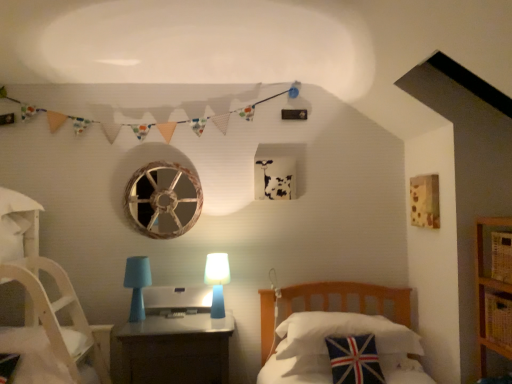
Question: From a real-world perspective, is yellow woven basket at lower right positioned over matte plastic nightstand at center based on gravity?

Choices:
 (A) yes
 (B) no

Answer: (A)

Question: Is yellow woven basket at lower right to the left of matte plastic nightstand at center from the viewer's perspective?

Choices:
 (A) yes
 (B) no

Answer: (B)

Question: Can you confirm if yellow woven basket at lower right is shorter than matte plastic nightstand at center?

Choices:
 (A) yes
 (B) no

Answer: (A)

Question: Can you confirm if yellow woven basket at lower right is thinner than matte plastic nightstand at center?

Choices:
 (A) yes
 (B) no

Answer: (A)

Question: Can you confirm if yellow woven basket at lower right is taller than matte plastic nightstand at center?

Choices:
 (A) yes
 (B) no

Answer: (B)

Question: Is point (212, 281) closer or farther from the camera than point (358, 347)?

Choices:
 (A) closer
 (B) farther

Answer: (B)

Question: Is blue matte table lamp at center, positioned as the 1th table lamp in right-to-left order, inside the boundaries of union jack fabric pillow at lower right, which is the second pillow from back to front, or outside?

Choices:
 (A) outside
 (B) inside

Answer: (A)

Question: Considering the relative positions of blue matte table lamp at center, positioned as the 1th table lamp in right-to-left order, and union jack fabric pillow at lower right, which appears as the first pillow when viewed from the front, in the image provided, is blue matte table lamp at center, positioned as the 1th table lamp in right-to-left order, to the left or to the right of union jack fabric pillow at lower right, which appears as the first pillow when viewed from the front,?

Choices:
 (A) right
 (B) left

Answer: (B)

Question: Is blue matte table lamp at center, positioned as the 1th table lamp in right-to-left order, bigger or smaller than union jack fabric pillow at lower right, which is the second pillow from back to front?

Choices:
 (A) big
 (B) small

Answer: (B)

Question: Considering the relative positions of matte plastic nightstand at center and satin silver desktop at center in the image provided, is matte plastic nightstand at center to the left or to the right of satin silver desktop at center?

Choices:
 (A) right
 (B) left

Answer: (A)

Question: Looking at the image, does matte plastic nightstand at center seem bigger or smaller compared to satin silver desktop at center?

Choices:
 (A) small
 (B) big

Answer: (B)

Question: Considering their positions, is matte plastic nightstand at center located in front of or behind satin silver desktop at center?

Choices:
 (A) front
 (B) behind

Answer: (A)

Question: Considering the positions of matte plastic nightstand at center and satin silver desktop at center in the image, is matte plastic nightstand at center wider or thinner than satin silver desktop at center?

Choices:
 (A) thin
 (B) wide

Answer: (B)

Question: In terms of size, does matte plastic nightstand at center appear bigger or smaller than union jack fabric pillow at center, which is the 2th pillow from front to back?

Choices:
 (A) small
 (B) big

Answer: (B)

Question: Is matte plastic nightstand at center inside the boundaries of union jack fabric pillow at center, which appears as the 1th pillow when viewed from the back, or outside?

Choices:
 (A) inside
 (B) outside

Answer: (B)